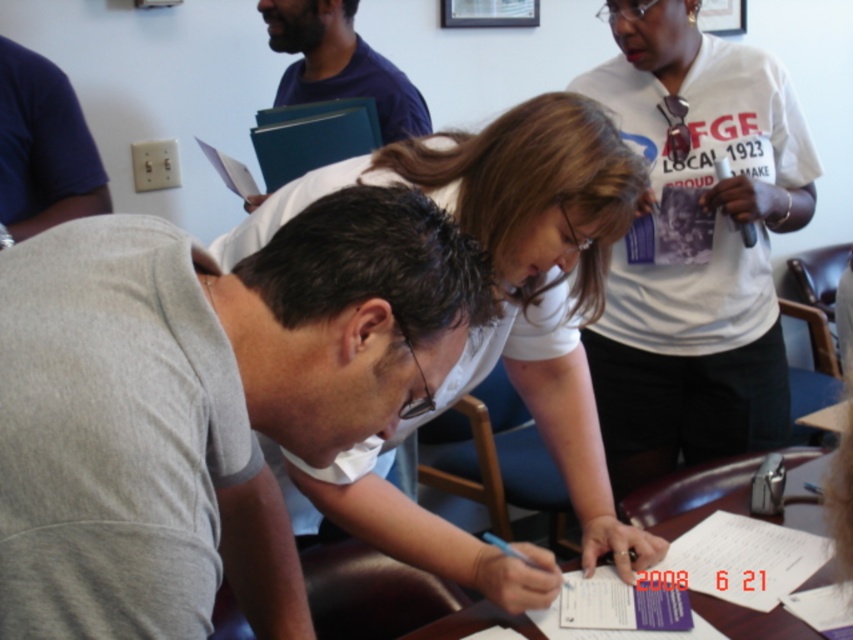
Question: Which object is positioned closest to the white paper at center?

Choices:
 (A) gray matte shirt at center
 (B) blue fabric folder at upper center

Answer: (A)

Question: Where is gray matte shirt at center located in relation to white paper at center in the image?

Choices:
 (A) left
 (B) right

Answer: (A)

Question: Can you confirm if white matte shirt at center is positioned below white paper at center?

Choices:
 (A) yes
 (B) no

Answer: (B)

Question: Considering the real-world distances, which object is farthest from the white paper at center?

Choices:
 (A) blue fabric folder at upper center
 (B) gray matte shirt at center
 (C) dark blue t-shirt at upper left
 (D) white matte shirt at center

Answer: (C)

Question: Is white matte shirt at center to the left of white cotton t-shirt at upper right from the viewer's perspective?

Choices:
 (A) yes
 (B) no

Answer: (A)

Question: Which point is closer to the camera?

Choices:
 (A) (289, 284)
 (B) (317, 13)

Answer: (A)